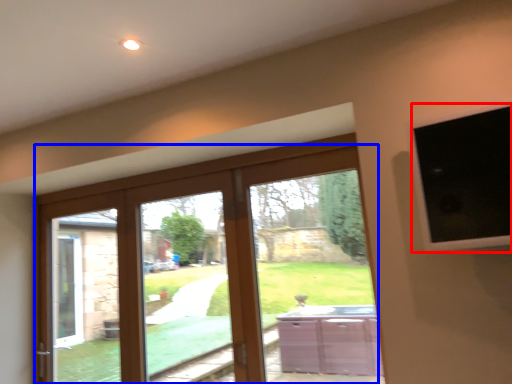
Question: Which point is further to the camera, window screen (highlighted by a red box) or door (highlighted by a blue box)?

Choices:
 (A) window screen
 (B) door

Answer: (B)